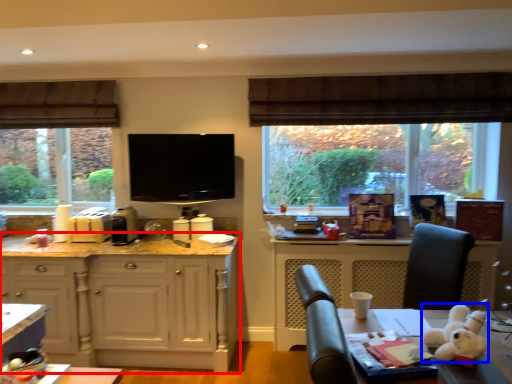
Question: Which object is further to the camera taking this photo, cabinetry (highlighted by a red box) or animal (highlighted by a blue box)?

Choices:
 (A) cabinetry
 (B) animal

Answer: (A)